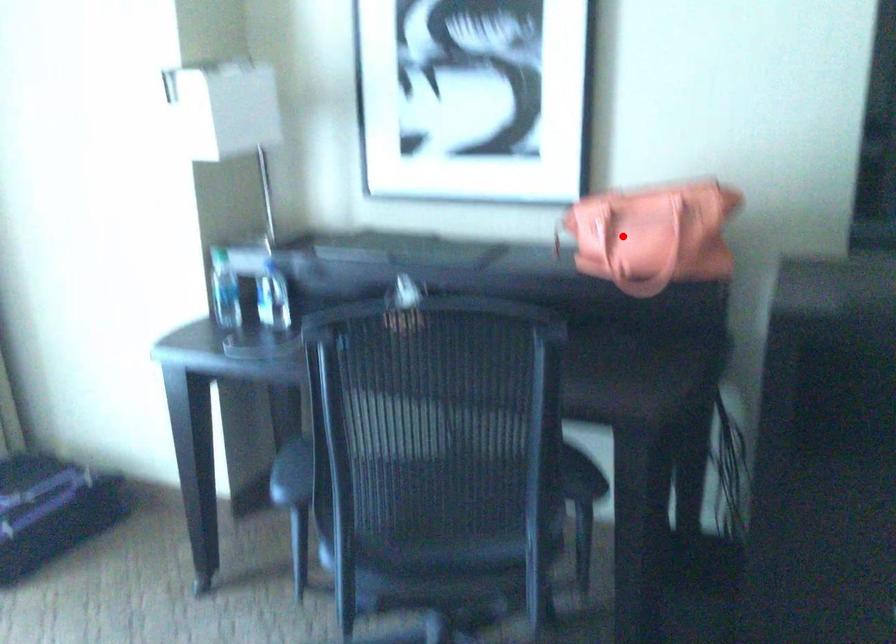
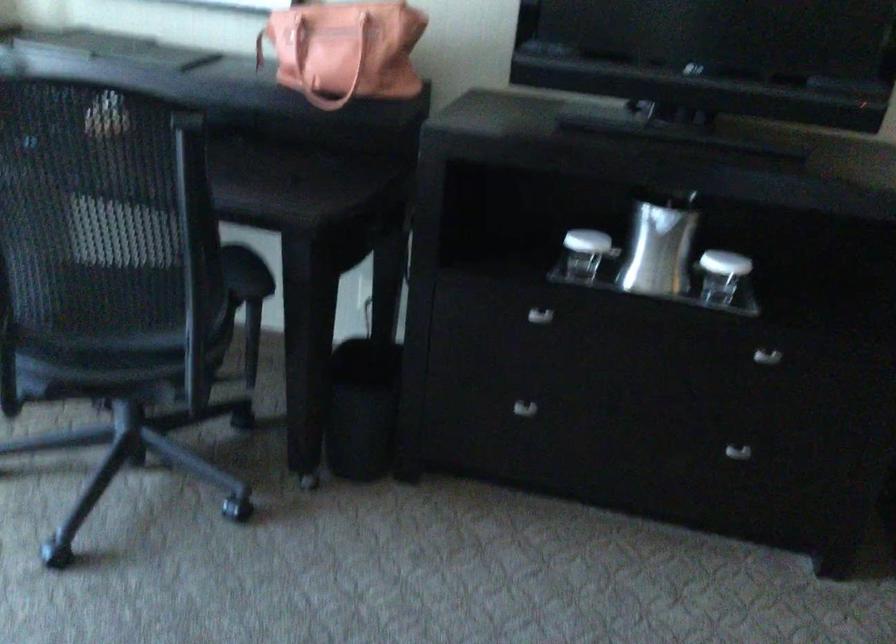
Where in the second image is the point corresponding to the highlighted location from the first image?

(315, 57)